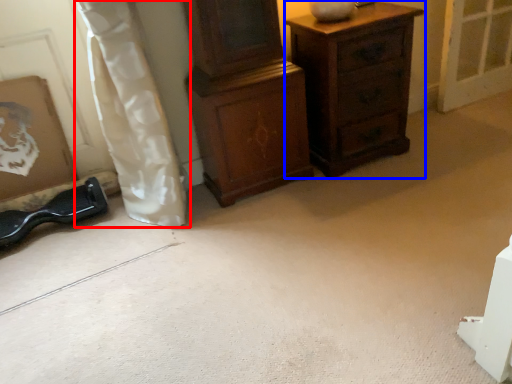
Question: Among these objects, which one is farthest to the camera, curtain (highlighted by a red box) or chest of drawers (highlighted by a blue box)?

Choices:
 (A) curtain
 (B) chest of drawers

Answer: (B)